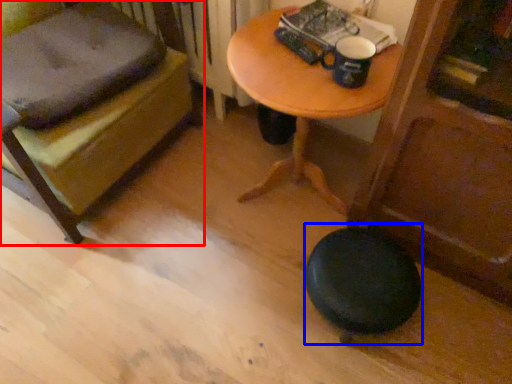
Question: Which point is further to the camera, furniture (highlighted by a red box) or stool (highlighted by a blue box)?

Choices:
 (A) furniture
 (B) stool

Answer: (B)